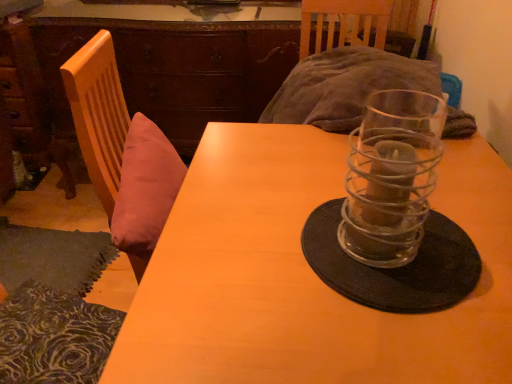
Locate an element on the screen. The height and width of the screenshot is (384, 512). free spot above wooden table at center (from a real-world perspective) is located at coordinates (334, 247).